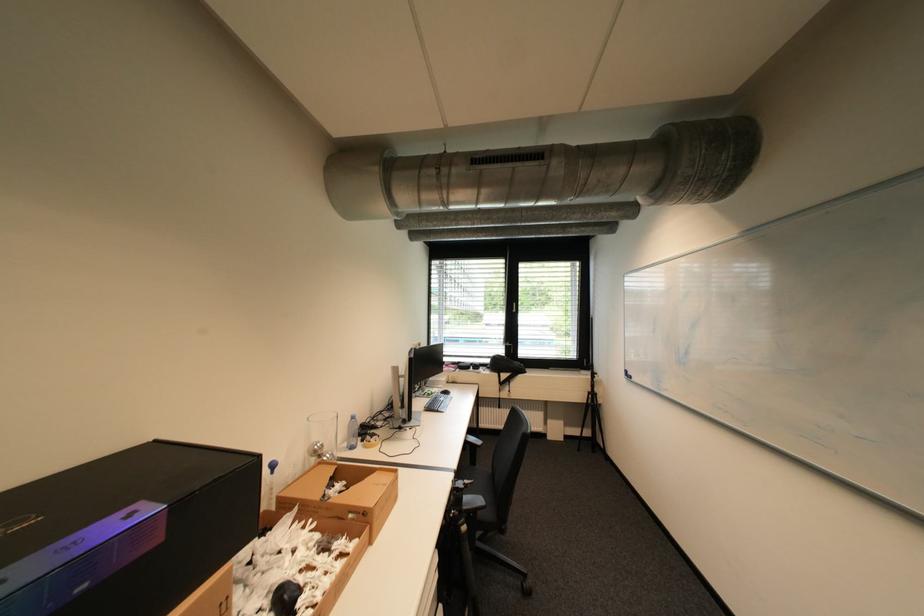
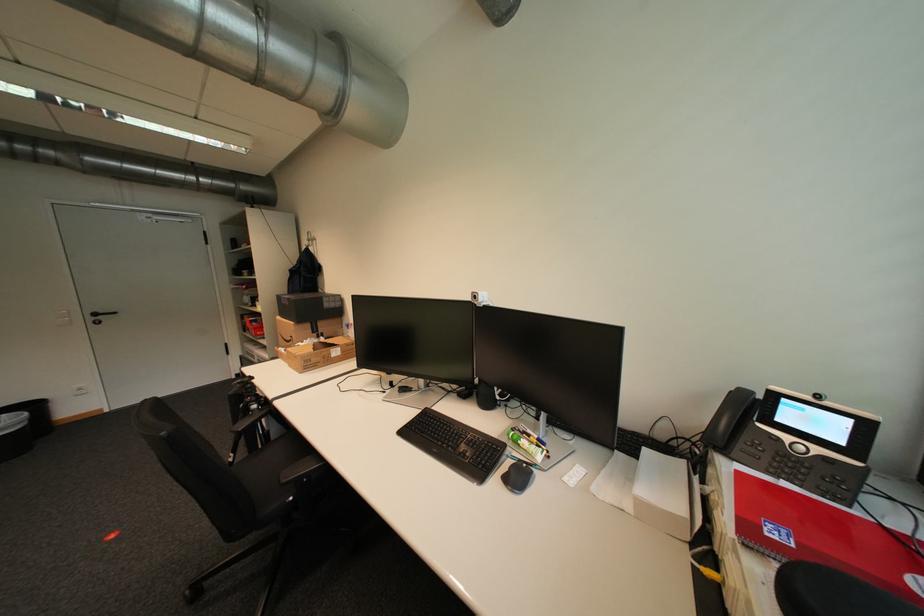
Where in the second image is the point corresponding to point 171,541 from the first image?

(296, 305)